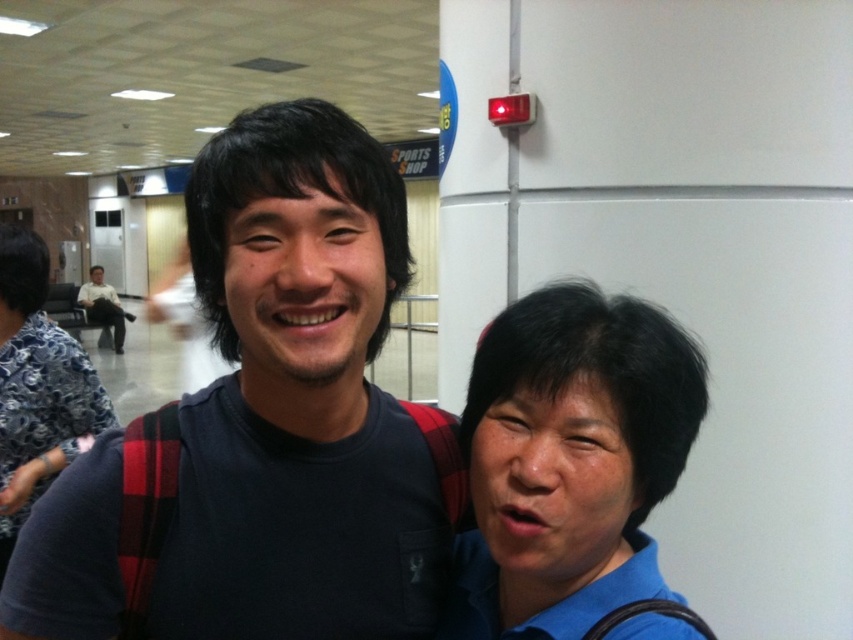
You are standing in an airport and want to take a photo of the point at coordinates (125, 582). The camera you are using has a minimum focus distance of 30 inches. Will the camera be able to focus on the point?

The point at coordinates (125, 582) is 28.26 inches away from the camera, which is less than the minimum focus distance of 30 inches. Therefore, the camera may not be able to focus on the point.

You are a photographer trying to capture a candid shot of the two people in the scene. You want to ensure that the blue fabric shirt at right and the matte black shirt at left are both visible in the frame. Based on their positions, which direction should you move to include both subjects without zooming?

Since the blue fabric shirt at right is to the right of the matte black shirt at left, you should move to the left to include both subjects in the frame without zooming.